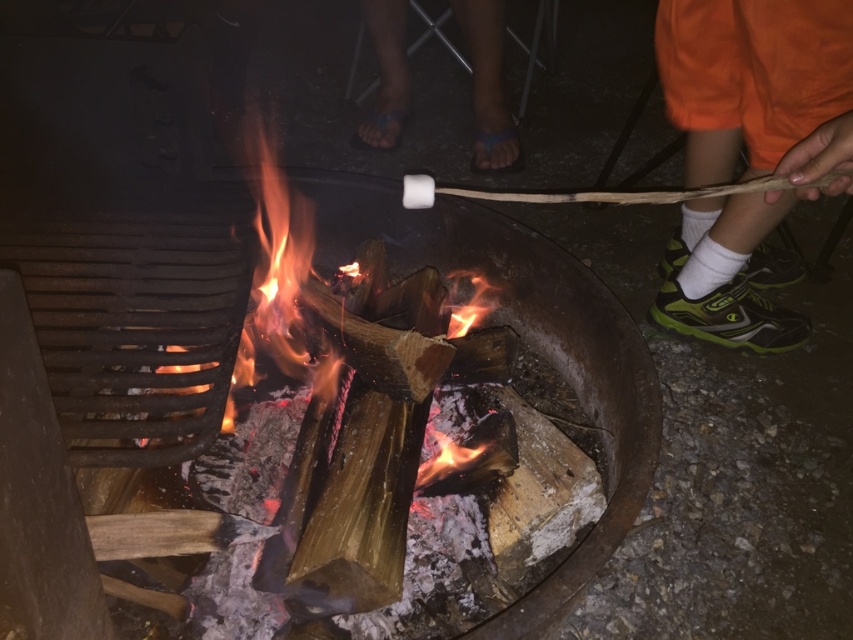
Is orange fabric sock at lower right bigger than blue rubber sandals at center?

Yes.

Which is more to the left, orange fabric sock at lower right or blue rubber sandals at center?

blue rubber sandals at center

Is point (781, 4) in front of point (409, 88)?

Yes, it is.

Locate an element on the screen. The image size is (853, 640). orange fabric sock at lower right is located at coordinates (751, 77).